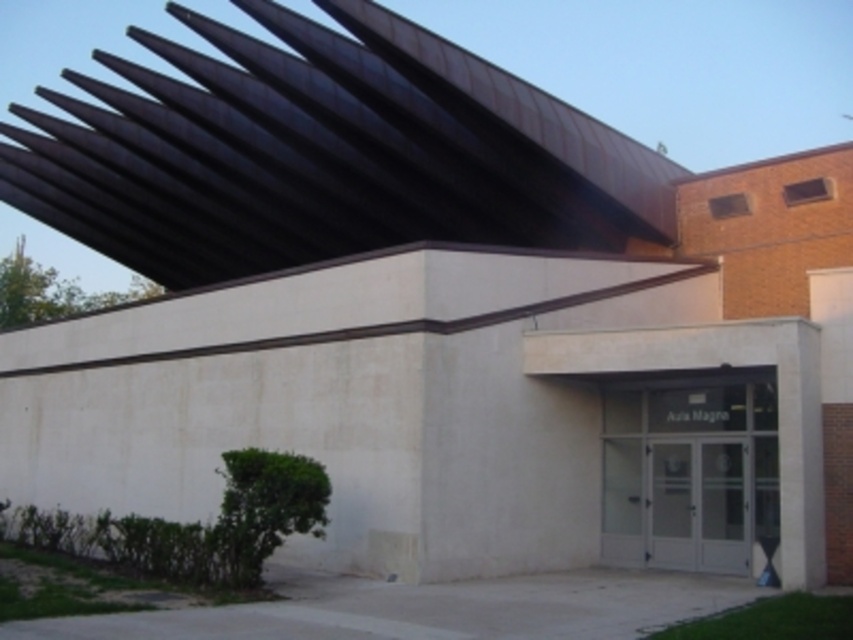
Is black corrugated metal roof at upper center to the left of clear glass doors at center from the viewer's perspective?

Correct, you'll find black corrugated metal roof at upper center to the left of clear glass doors at center.

Based on the photo, who is more forward, (433,61) or (763,410)?

Point (763,410) is more forward.

Find the location of a particular element. black corrugated metal roof at upper center is located at coordinates (326, 154).